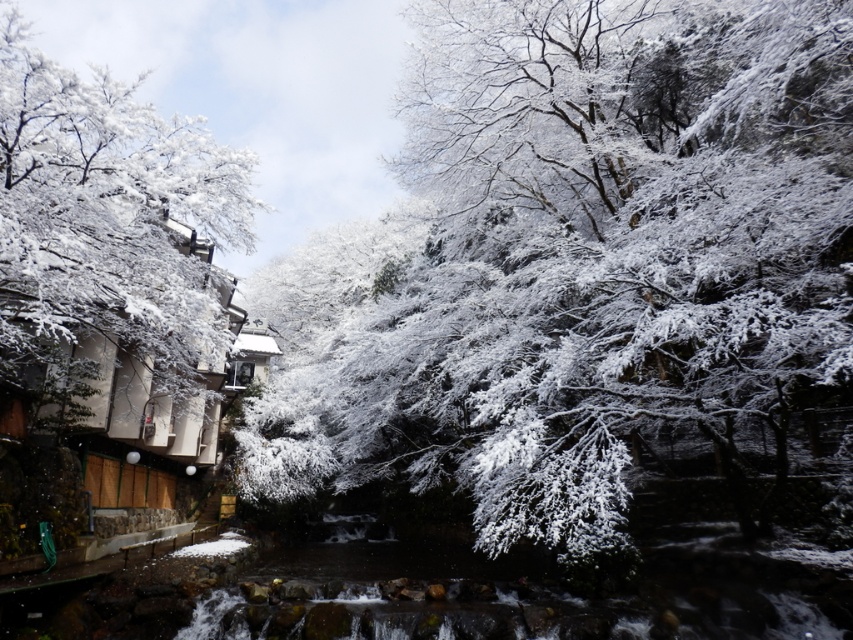
Question: Which point appears closest to the camera in this image?

Choices:
 (A) (614, 378)
 (B) (78, 292)

Answer: (B)

Question: Observing the image, what is the correct spatial positioning of snow-covered branches at center in reference to white snow-covered tree at left?

Choices:
 (A) right
 (B) left

Answer: (A)

Question: Is snow-covered branches at center smaller than white snow-covered tree at left?

Choices:
 (A) no
 (B) yes

Answer: (A)

Question: Among these points, which one is nearest to the camera?

Choices:
 (A) (825, 356)
 (B) (51, 268)

Answer: (A)

Question: Which point is closer to the camera?

Choices:
 (A) (25, 300)
 (B) (564, 257)

Answer: (A)

Question: Is snow-covered branches at center thinner than white snow-covered tree at left?

Choices:
 (A) no
 (B) yes

Answer: (A)